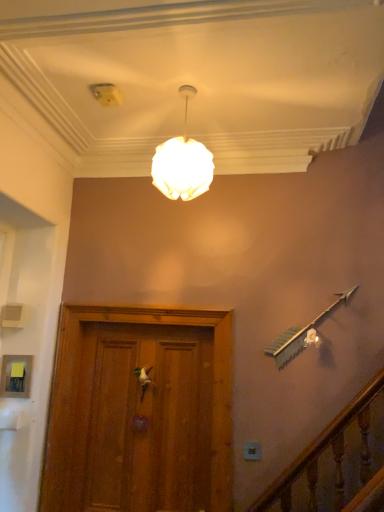
Question: From a real-world perspective, is white matte door handle at center under white plastic electric outlet at lower center?

Choices:
 (A) no
 (B) yes

Answer: (A)

Question: Can we say white matte door handle at center lies outside white plastic electric outlet at lower center?

Choices:
 (A) no
 (B) yes

Answer: (B)

Question: Is white matte door handle at center at the left side of white plastic electric outlet at lower center?

Choices:
 (A) no
 (B) yes

Answer: (B)

Question: From a real-world perspective, is white matte door handle at center on white plastic electric outlet at lower center?

Choices:
 (A) yes
 (B) no

Answer: (A)

Question: Is the depth of white matte door handle at center less than that of white plastic electric outlet at lower center?

Choices:
 (A) yes
 (B) no

Answer: (B)

Question: Is white matte sphere at upper center wider or thinner than white matte door handle at center?

Choices:
 (A) wide
 (B) thin

Answer: (A)

Question: Visually, is white matte sphere at upper center positioned to the left or to the right of white matte door handle at center?

Choices:
 (A) left
 (B) right

Answer: (B)

Question: Looking at the image, does white matte sphere at upper center seem bigger or smaller compared to white matte door handle at center?

Choices:
 (A) big
 (B) small

Answer: (A)

Question: In terms of height, does white matte sphere at upper center look taller or shorter compared to white matte door handle at center?

Choices:
 (A) short
 (B) tall

Answer: (B)

Question: From a real-world perspective, is white plastic electric outlet at lower center physically located above or below white matte sphere at upper center?

Choices:
 (A) above
 (B) below

Answer: (B)

Question: Looking at their shapes, would you say white plastic electric outlet at lower center is wider or thinner than white matte sphere at upper center?

Choices:
 (A) wide
 (B) thin

Answer: (B)

Question: Is point coord(256,449) closer or farther from the camera than point coord(185,91)?

Choices:
 (A) farther
 (B) closer

Answer: (A)

Question: Looking at the image, does white plastic electric outlet at lower center seem bigger or smaller compared to white matte sphere at upper center?

Choices:
 (A) big
 (B) small

Answer: (B)

Question: From the image's perspective, is white matte door handle at center positioned above or below white plastic electric outlet at lower center?

Choices:
 (A) below
 (B) above

Answer: (B)

Question: Based on their sizes in the image, would you say white matte door handle at center is bigger or smaller than white plastic electric outlet at lower center?

Choices:
 (A) big
 (B) small

Answer: (A)